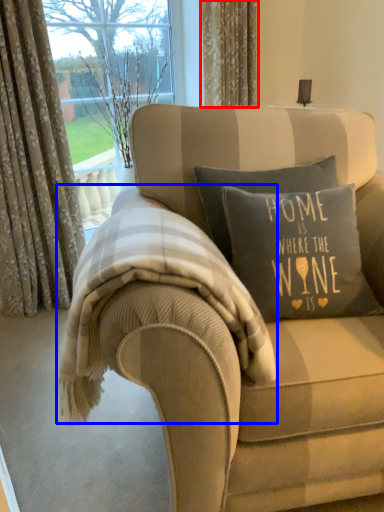
Question: Among these objects, which one is farthest to the camera, curtain (highlighted by a red box) or bedding (highlighted by a blue box)?

Choices:
 (A) curtain
 (B) bedding

Answer: (A)